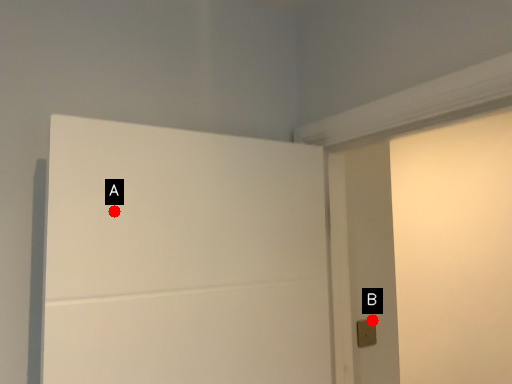
Question: Two points are circled on the image, labeled by A and B beside each circle. Which of the following is the farthest from the observer?

Choices:
 (A) A is further
 (B) B is further

Answer: (B)